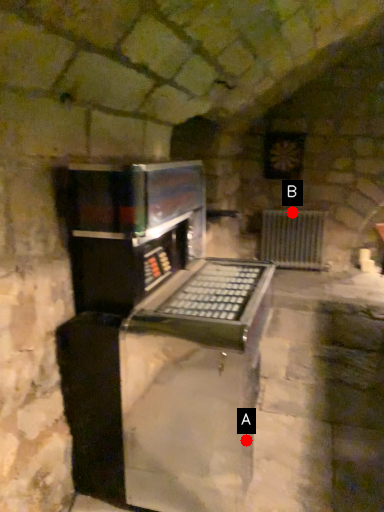
Question: Two points are circled on the image, labeled by A and B beside each circle. Which of the following is the farthest from the observer?

Choices:
 (A) A is further
 (B) B is further

Answer: (B)